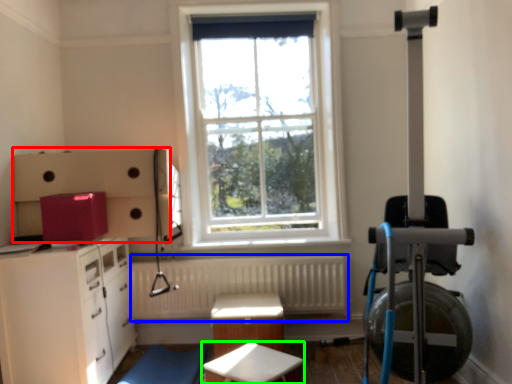
Question: Considering the real-world distances, which object is farthest from cabinetry (highlighted by a red box)? radiator (highlighted by a blue box) or table (highlighted by a green box)?

Choices:
 (A) radiator
 (B) table

Answer: (B)